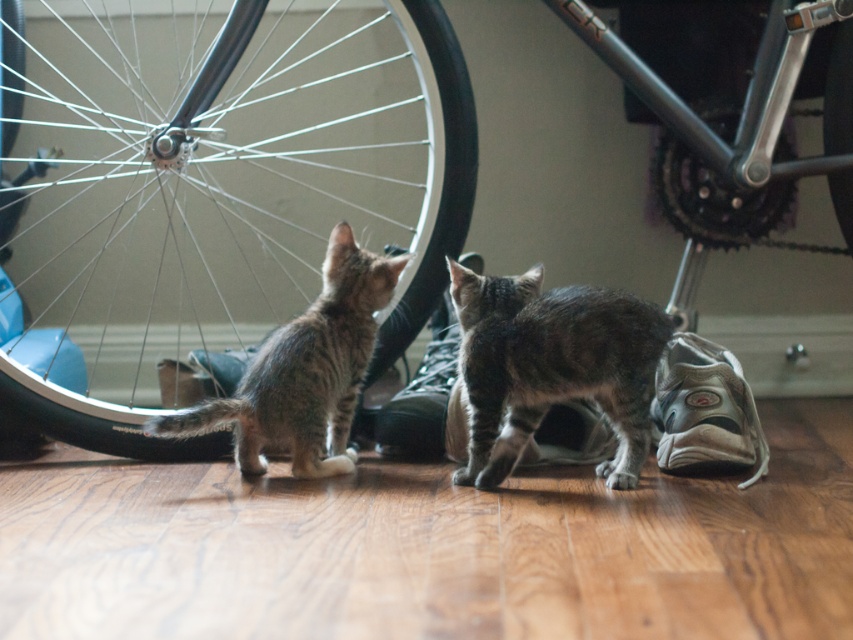
Question: Can you confirm if white mesh shoe at lower right is positioned to the right of black leather shoe at center?

Choices:
 (A) no
 (B) yes

Answer: (B)

Question: Which point is closer to the camera taking this photo?

Choices:
 (A) (405, 262)
 (B) (844, 212)
 (C) (412, 445)
 (D) (724, 465)

Answer: (D)

Question: Estimate the real-world distances between objects in this image. Which object is closer to the brushed metal wheel at center?

Choices:
 (A) gray tabby cat at center
 (B) black leather shoe at center

Answer: (A)

Question: Is metallic silver wheel at upper left wider than tabby fur kitten at center?

Choices:
 (A) no
 (B) yes

Answer: (B)

Question: Which of the following is the closest to the observer?

Choices:
 (A) brushed metal wheel at center
 (B) black leather shoe at center

Answer: (B)

Question: Is metallic silver wheel at upper left in front of black leather shoe at center?

Choices:
 (A) yes
 (B) no

Answer: (A)